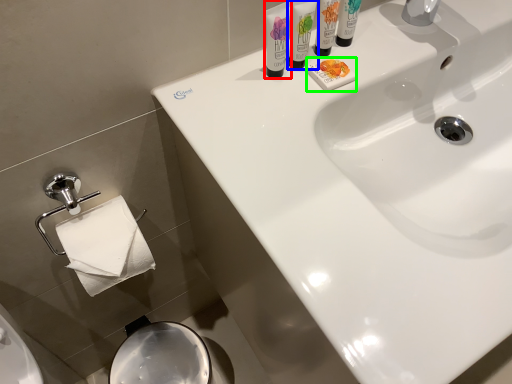
Question: Which object is the closest to the shaving cream (highlighted by a red box)? Choose among these: shaving cream (highlighted by a blue box) or soap (highlighted by a green box).

Choices:
 (A) shaving cream
 (B) soap

Answer: (A)